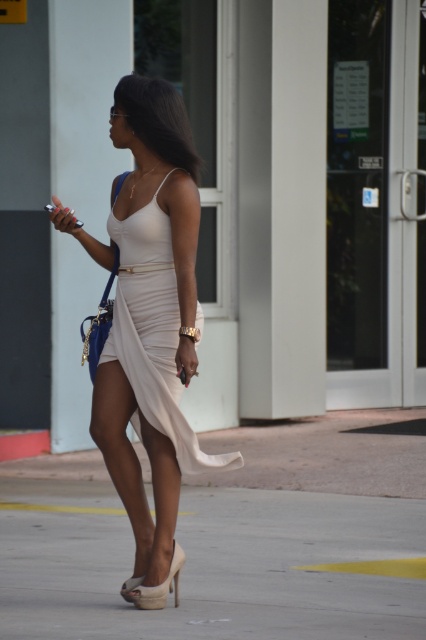
Question: Which of the following is the closest to the observer?

Choices:
 (A) beige concrete pavement at lower center
 (B) matte white dress at center

Answer: (A)

Question: Can you confirm if beige concrete pavement at lower center is positioned to the right of beige suede sandal at lower center?

Choices:
 (A) yes
 (B) no

Answer: (A)

Question: Does beige concrete pavement at lower center have a greater width compared to beige suede sandal at lower center?

Choices:
 (A) no
 (B) yes

Answer: (B)

Question: Does white satin dress at center appear on the left side of beige suede sandal at lower center?

Choices:
 (A) no
 (B) yes

Answer: (B)

Question: Considering the real-world distances, which object is closest to the matte white dress at center?

Choices:
 (A) white satin dress at center
 (B) beige concrete pavement at lower center

Answer: (A)

Question: Which of the following is the farthest from the observer?

Choices:
 (A) beige suede sandal at lower center
 (B) beige concrete pavement at lower center
 (C) matte white dress at center

Answer: (A)